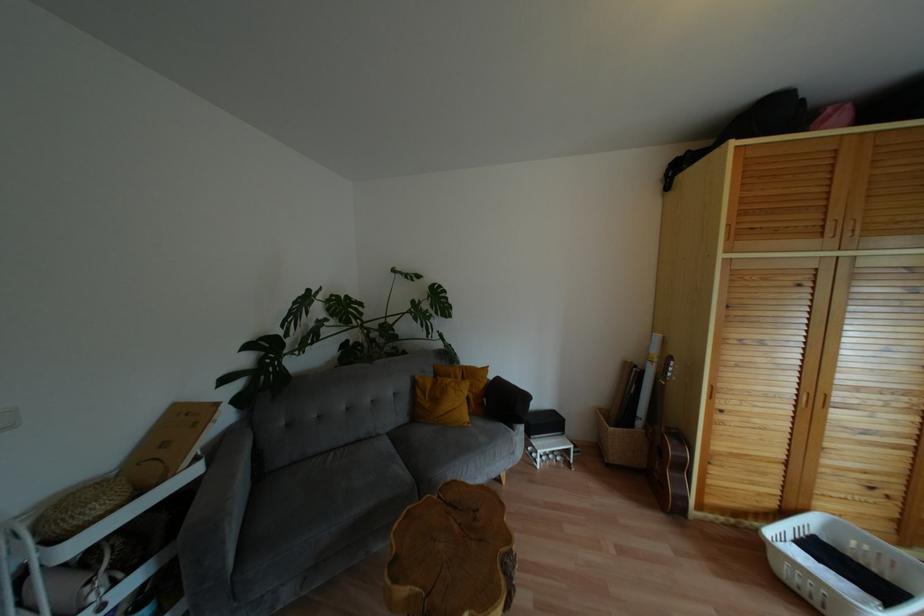
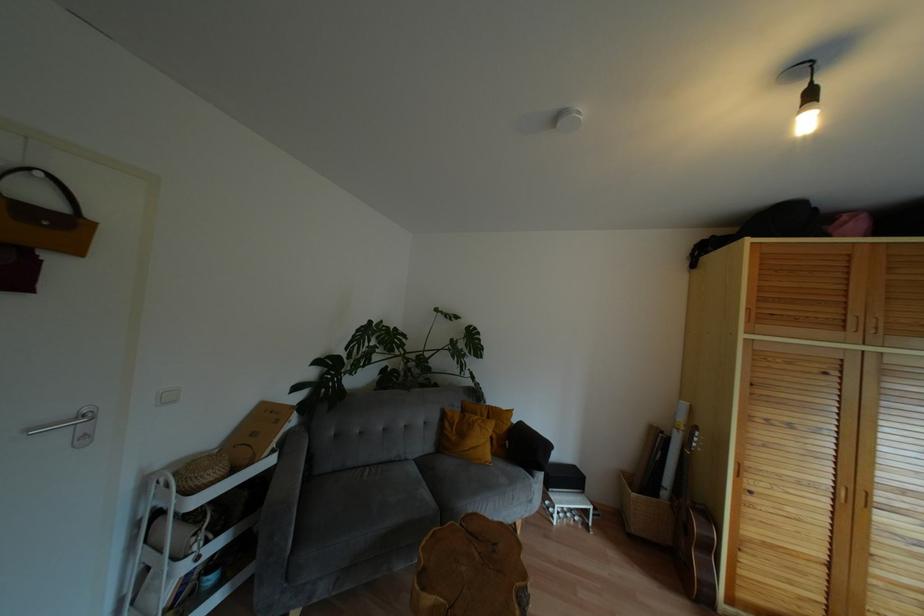
Where in the second image is the point corresponding to point 210,451 from the first image?

(282, 446)